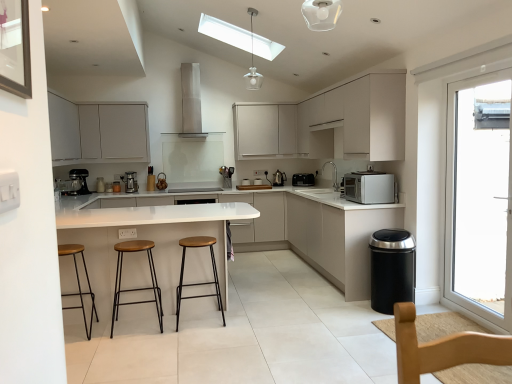
The width and height of the screenshot is (512, 384). In order to click on vacant space in front of wooden seat stool at center, arranged as the 3th stool when viewed from the left in this screenshot , I will do `click(198, 337)`.